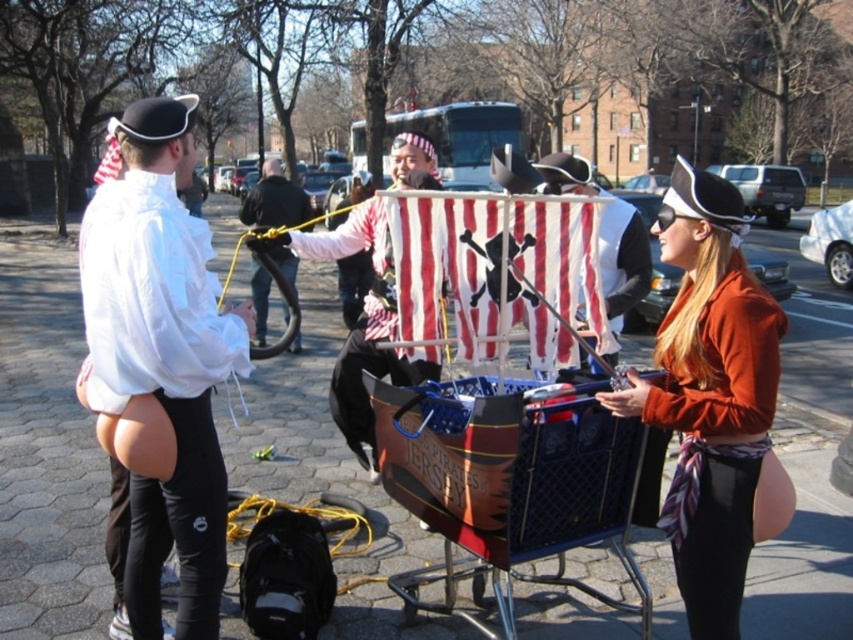
Question: Does orange fleece jacket at center appear on the left side of black leather jacket at center?

Choices:
 (A) no
 (B) yes

Answer: (A)

Question: Which object is positioned closest to the black leather jacket at center?

Choices:
 (A) white matte shirt at left
 (B) matte white pirate hat at center
 (C) striped fabric pirate hat at center
 (D) orange fleece jacket at center

Answer: (C)

Question: Is the position of matte white pirate hat at center more distant than that of black leather jacket at center?

Choices:
 (A) no
 (B) yes

Answer: (A)

Question: Among these points, which one is farthest from the camera?

Choices:
 (A) pyautogui.click(x=279, y=204)
 (B) pyautogui.click(x=200, y=484)
 (C) pyautogui.click(x=601, y=241)

Answer: (A)

Question: Based on their relative distances, which object is nearer to the orange fleece jacket at center?

Choices:
 (A) black leather jacket at center
 (B) white matte shirt at left
 (C) matte white pirate hat at center
 (D) striped fabric pirate hat at center

Answer: (C)

Question: Does orange fleece jacket at center have a smaller size compared to matte white pirate hat at center?

Choices:
 (A) yes
 (B) no

Answer: (A)